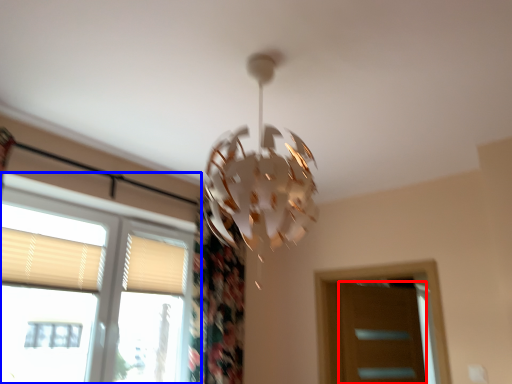
Question: Among these objects, which one is farthest to the camera, screen door (highlighted by a red box) or window (highlighted by a blue box)?

Choices:
 (A) screen door
 (B) window

Answer: (A)